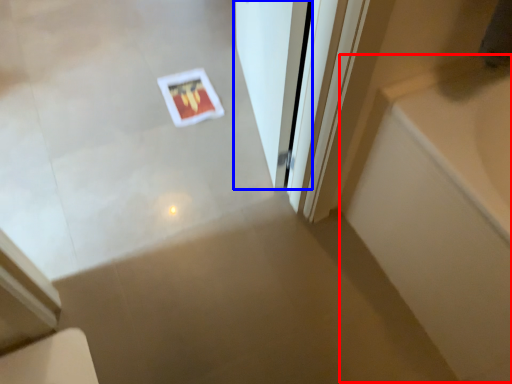
Question: Among these objects, which one is nearest to the camera, bath (highlighted by a red box) or door (highlighted by a blue box)?

Choices:
 (A) bath
 (B) door

Answer: (A)